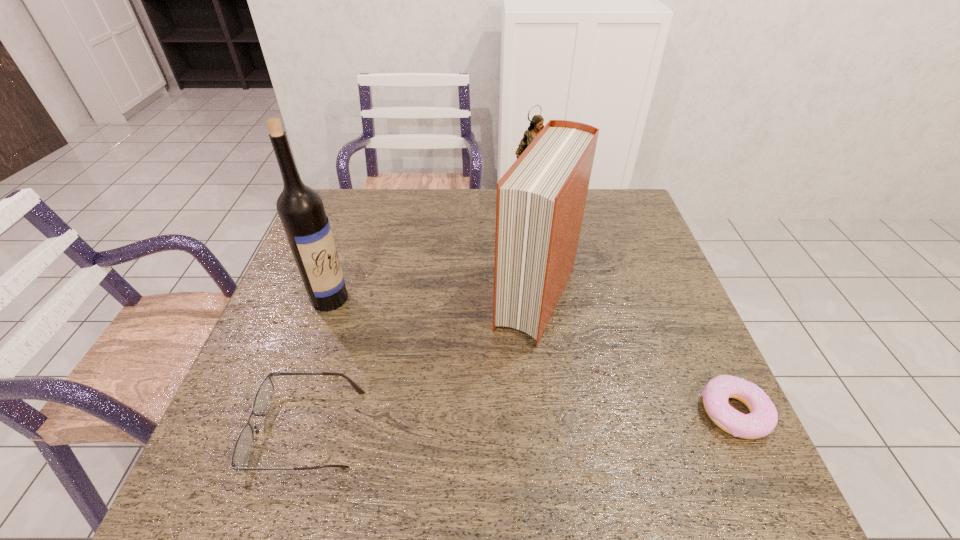
Image resolution: width=960 pixels, height=540 pixels. What are the coordinates of `free region located on the label of the wine bottle` in the screenshot? It's located at (405, 347).

This screenshot has height=540, width=960. I want to click on free region located on the open cover of the hardback book, so click(x=488, y=408).

This screenshot has width=960, height=540. I want to click on vacant space located 0.060m on the open cover of the hardback book, so click(511, 361).

Find the location of a particular element. This screenshot has height=540, width=960. vacant space positioned on the open cover of the hardback book is located at coordinates (508, 368).

Find the location of a particular element. free space located on the front-facing side of the figurine is located at coordinates coord(530,246).

Where is `vacant space situated 0.080m on the front-facing side of the figurine`? This screenshot has height=540, width=960. vacant space situated 0.080m on the front-facing side of the figurine is located at coordinates (531, 241).

This screenshot has height=540, width=960. Find the location of `vacant region located 0.350m on the front-facing side of the figurine`. vacant region located 0.350m on the front-facing side of the figurine is located at coordinates tap(527, 307).

Locate an element on the screen. The width and height of the screenshot is (960, 540). object that is at the far edge is located at coordinates (536, 125).

Locate an element on the screen. The image size is (960, 540). spectacles that is at the near edge is located at coordinates (244, 441).

The image size is (960, 540). What are the coordinates of `doughnut present at the near edge` in the screenshot? It's located at (763, 417).